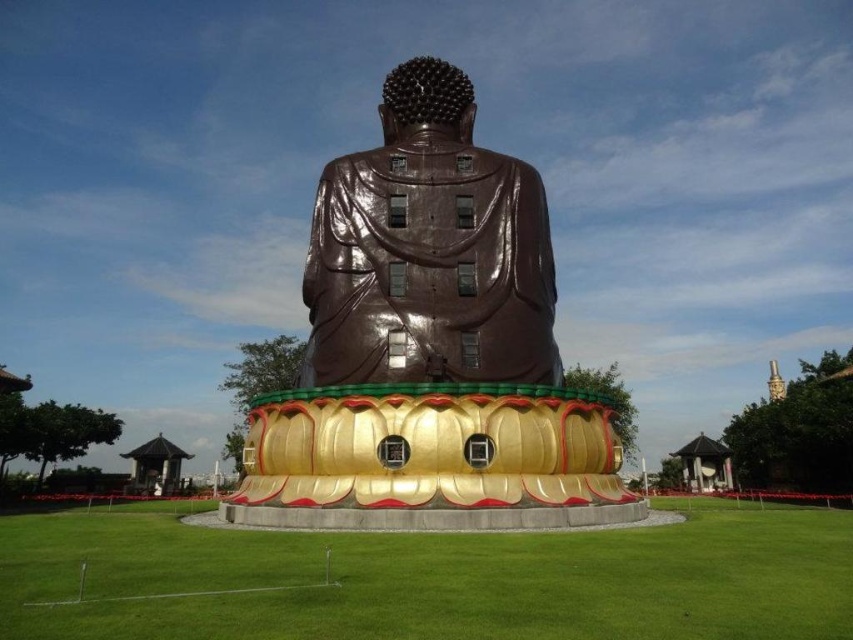
How far apart are bronze statue at center and shiny bronze statue at center?

bronze statue at center is 5.62 feet from shiny bronze statue at center.

Image resolution: width=853 pixels, height=640 pixels. Find the location of `bronze statue at center`. bronze statue at center is located at coordinates (428, 346).

The height and width of the screenshot is (640, 853). Identify the location of bronze statue at center. (428, 346).

Where is `bronze statue at center`? bronze statue at center is located at coordinates (428, 346).